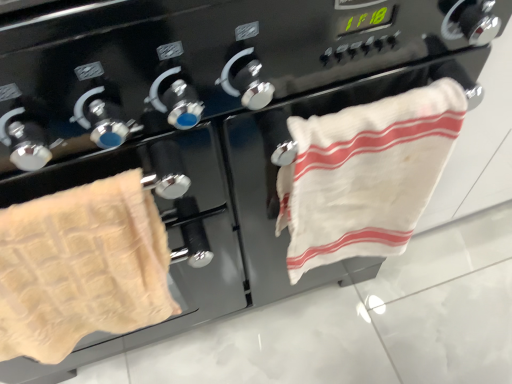
Question: Is point (33, 339) positioned closer to the camera than point (338, 182)?

Choices:
 (A) farther
 (B) closer

Answer: (A)

Question: From the image's perspective, is beige waffle towel at left, which is the first towel in left-to-right order, positioned above or below white cotton towel at right, which is the first towel from right to left?

Choices:
 (A) below
 (B) above

Answer: (A)

Question: Is beige waffle towel at left, acting as the 2th towel starting from the right, to the left or to the right of white cotton towel at right, which is counted as the 2th towel, starting from the left, in the image?

Choices:
 (A) left
 (B) right

Answer: (A)

Question: Looking at the image, does white cotton towel at right, which is counted as the 2th towel, starting from the left, seem bigger or smaller compared to beige waffle towel at left, which is the first towel in left-to-right order?

Choices:
 (A) big
 (B) small

Answer: (B)

Question: From a real-world perspective, is white cotton towel at right, which is the first towel from right to left, physically located above or below beige waffle towel at left, acting as the 2th towel starting from the right?

Choices:
 (A) above
 (B) below

Answer: (B)

Question: Considering the positions of white cotton towel at right, which is the first towel from right to left, and beige waffle towel at left, which is the first towel in left-to-right order, in the image, is white cotton towel at right, which is the first towel from right to left, taller or shorter than beige waffle towel at left, which is the first towel in left-to-right order,?

Choices:
 (A) short
 (B) tall

Answer: (B)

Question: Relative to beige waffle towel at left, which is the first towel in left-to-right order, is white cotton towel at right, which is the first towel from right to left, in front or behind?

Choices:
 (A) front
 (B) behind

Answer: (B)